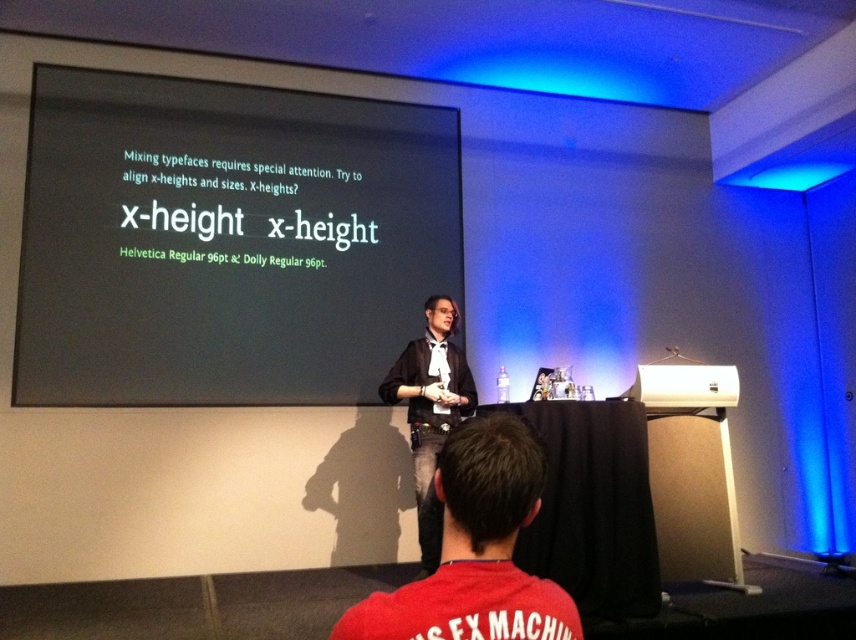
Who is more distant from viewer, (x=563, y=595) or (x=400, y=362)?

Positioned behind is point (x=400, y=362).

Between red cotton shirt at lower center and black leather jacket at center, which one appears on the right side from the viewer's perspective?

Positioned to the right is red cotton shirt at lower center.

Is point (544, 477) closer to viewer compared to point (383, 381)?

That is True.

Identify the location of red cotton shirt at lower center. This screenshot has width=856, height=640. (476, 548).

Does black matte projection screen at upper center have a larger size compared to black leather jacket at center?

Yes, black matte projection screen at upper center is bigger than black leather jacket at center.

Describe the element at coordinates (224, 241) in the screenshot. I see `black matte projection screen at upper center` at that location.

Between point (181, 275) and point (444, 305), which one is positioned behind?

Positioned behind is point (181, 275).

You are a GUI agent. You are given a task and a screenshot of the screen. Output one action in this format:
    pyautogui.click(x=<x>, y=<y>)
    Task: Click on the black matte projection screen at upper center
    The width and height of the screenshot is (856, 640).
    Given the screenshot: What is the action you would take?
    pyautogui.click(x=224, y=241)

This screenshot has height=640, width=856. Describe the element at coordinates (476, 548) in the screenshot. I see `red cotton shirt at lower center` at that location.

Between red cotton shirt at lower center and white plastic projector at center, which one is positioned higher?

red cotton shirt at lower center is higher up.

Is point (528, 465) positioned in front of point (706, 372)?

Yes, it is.

The width and height of the screenshot is (856, 640). Find the location of `red cotton shirt at lower center`. red cotton shirt at lower center is located at coordinates (476, 548).